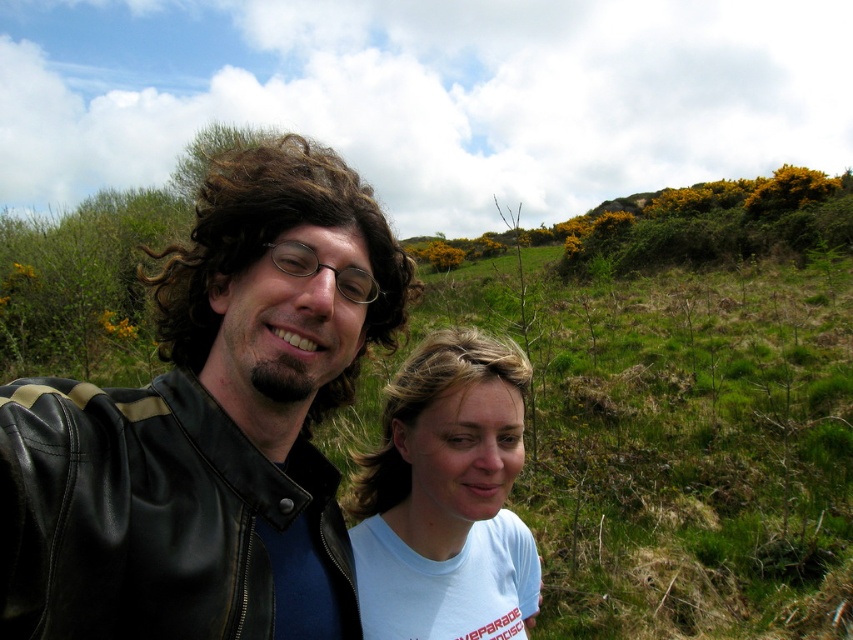
Question: Which object appears closest to the camera in this image?

Choices:
 (A) light blue t-shirt at center
 (B) green grassy hillside at upper center
 (C) black leather jacket at center

Answer: (C)

Question: Based on their relative distances, which object is farther from the green grassy hillside at upper center?

Choices:
 (A) light blue t-shirt at center
 (B) black leather jacket at center

Answer: (B)

Question: Can you confirm if green grassy hillside at upper center is positioned below light blue t-shirt at center?

Choices:
 (A) no
 (B) yes

Answer: (A)

Question: Does green grassy hillside at upper center have a smaller size compared to light blue t-shirt at center?

Choices:
 (A) no
 (B) yes

Answer: (A)

Question: Is green grassy hillside at upper center to the left of light blue t-shirt at center from the viewer's perspective?

Choices:
 (A) yes
 (B) no

Answer: (B)

Question: Which point is farther to the camera?

Choices:
 (A) green grassy hillside at upper center
 (B) black leather jacket at center
 (C) light blue t-shirt at center

Answer: (A)